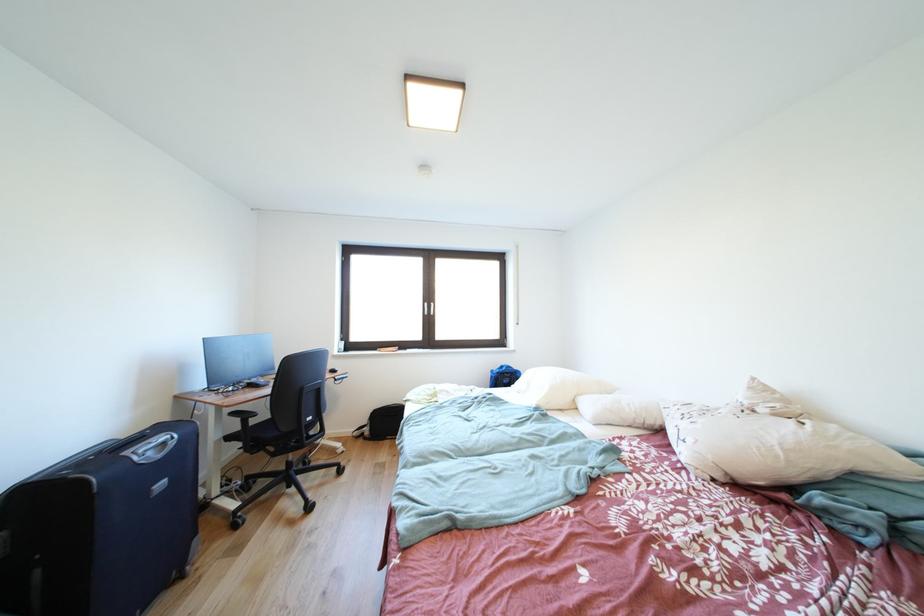
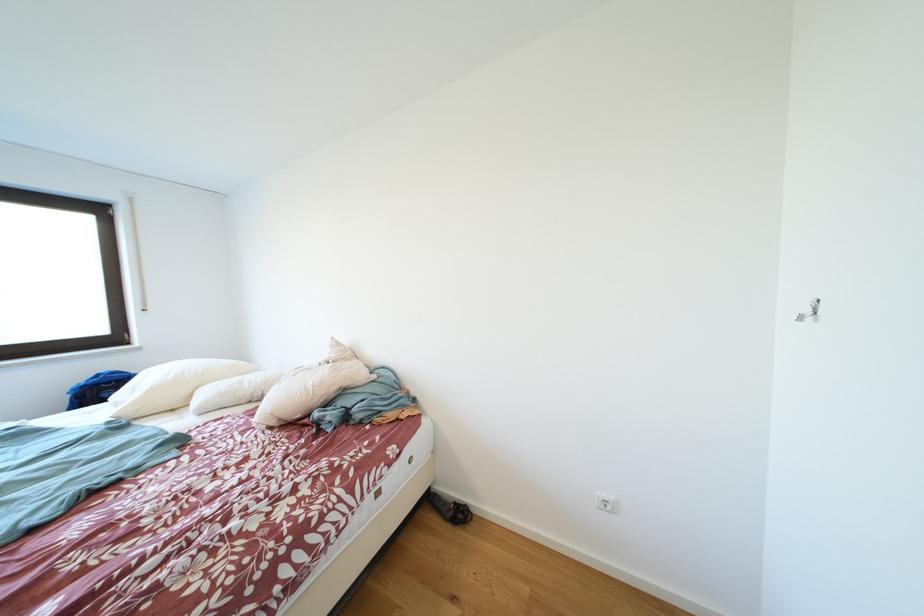
Question: Based on the continuous images, in which direction is the camera rotating? Reply with the corresponding letter.

Choices:
 (A) Left
 (B) Right
 (C) Up
 (D) Down

Answer: (B)